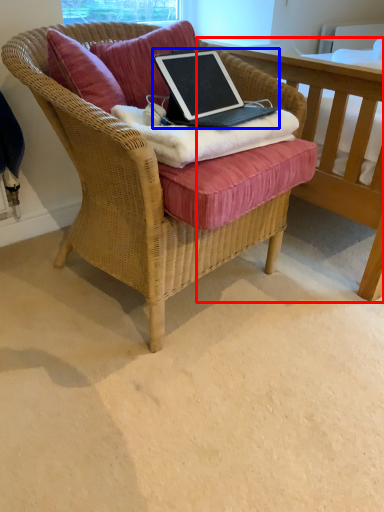
Question: Which of the following is the closest to the observer, table (highlighted by a red box) or laptop (highlighted by a blue box)?

Choices:
 (A) table
 (B) laptop

Answer: (B)